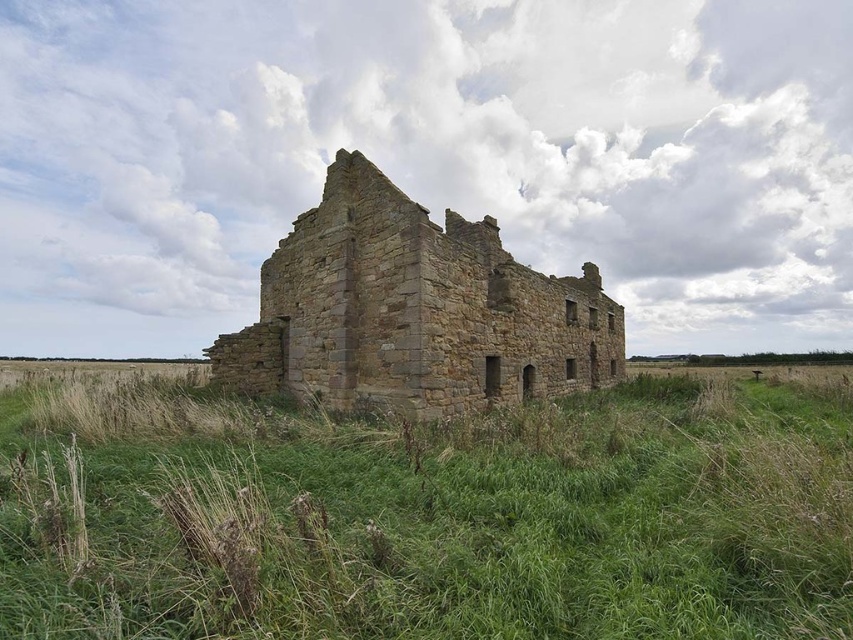
You are standing at the edge of the grassy field near the weathered stone structure. You want to place a small decorative garden statue exactly at the center of the green grass at center. According to the image, what are the coordinates where you should place the statue?

The coordinates for the green grass at center are at point (427, 515), so you should place the statue there.

You are a gardener trying to maintain the green grass at center and the brown stone castle at center. Which area requires more space for maintenance?

The brown stone castle at center requires more space for maintenance since the green grass at center occupies less space than it.

You are standing in the grassy field and see the green grass at center and the brown stone castle at center. Which object is located to the left of the other?

The green grass at center is positioned on the left side of brown stone castle at center.